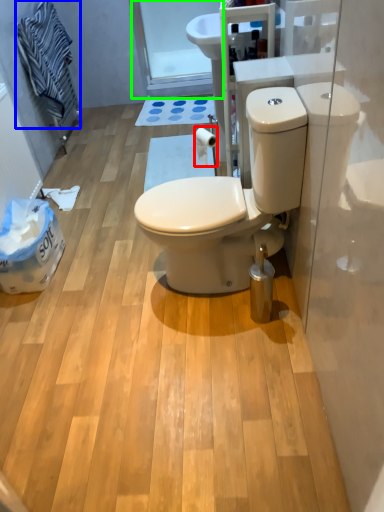
Question: Which is nearer to the toilet paper (highlighted by a red box)? laundry (highlighted by a blue box) or glass door (highlighted by a green box).

Choices:
 (A) laundry
 (B) glass door

Answer: (A)